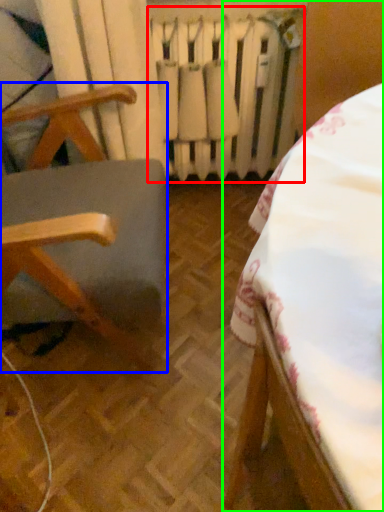
Question: Considering the real-world distances, which object is farthest from radiator (highlighted by a red box)? furniture (highlighted by a blue box) or furniture (highlighted by a green box)?

Choices:
 (A) furniture
 (B) furniture

Answer: (B)